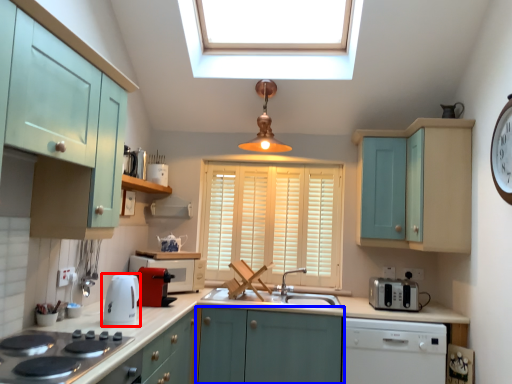
Question: Which point is further to the camera, kitchen appliance (highlighted by a red box) or cabinetry (highlighted by a blue box)?

Choices:
 (A) kitchen appliance
 (B) cabinetry

Answer: (B)